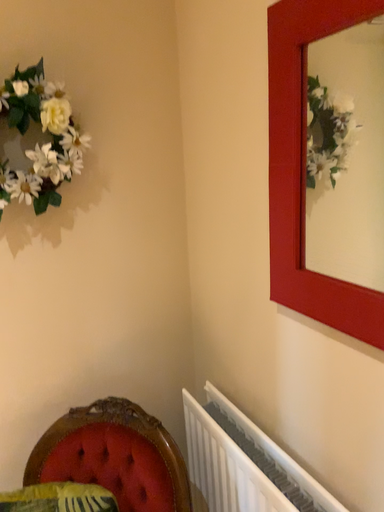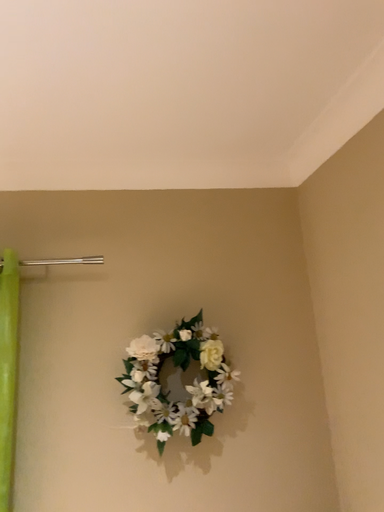
Question: How did the camera likely rotate when shooting the video?

Choices:
 (A) rotated upward
 (B) rotated downward

Answer: (A)